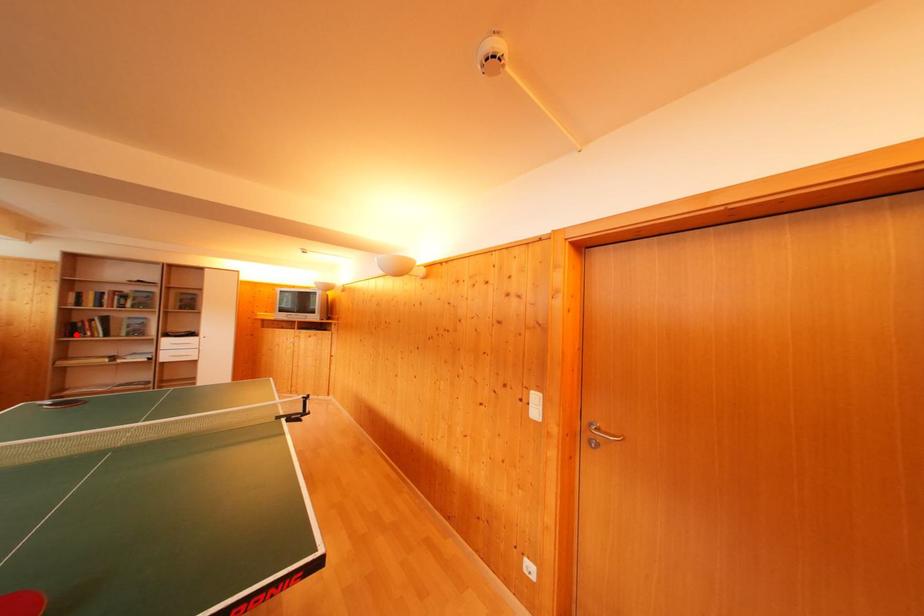
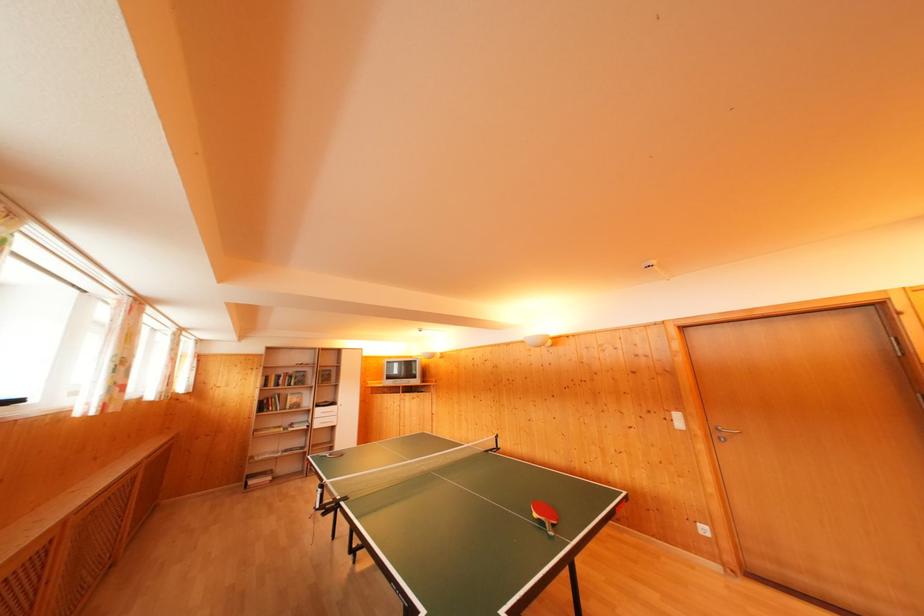
Locate, in the second image, the point that corresponds to the highlighted location in the first image.

(268, 411)